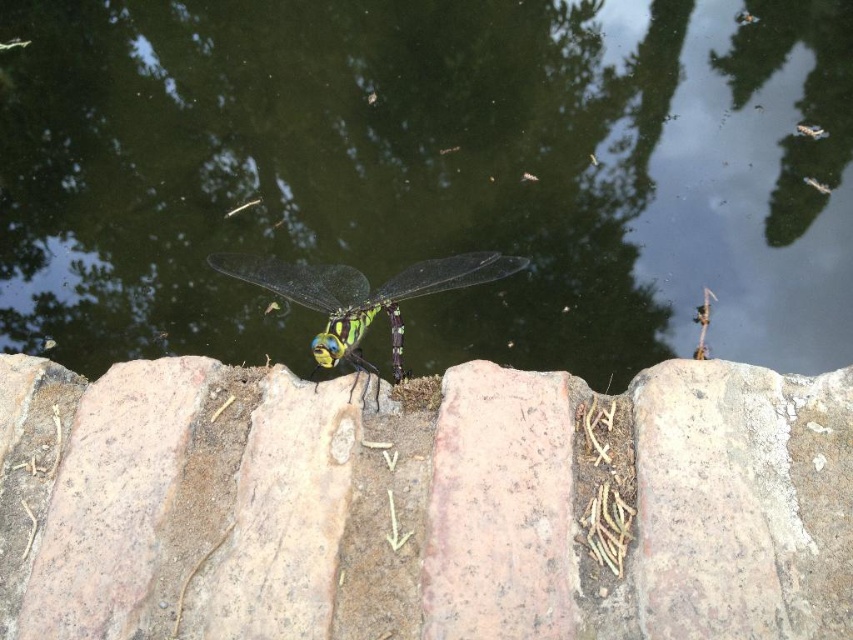
Can you confirm if greenish water at center is positioned above smooth stone at center?

Yes.

Does point (476, 40) come farther from viewer compared to point (236, 589)?

That is True.

Does point (639, 289) come in front of point (267, 608)?

No, it is behind (267, 608).

Identify the location of greenish water at center. The image size is (853, 640). (430, 173).

Can you confirm if greenish water at center is positioned to the left of transparent glass dragonfly at center?

No, greenish water at center is not to the left of transparent glass dragonfly at center.

Between point (39, 204) and point (257, 266), which one is positioned behind?

The point (39, 204) is more distant.

Locate an element on the screen. Image resolution: width=853 pixels, height=640 pixels. greenish water at center is located at coordinates (430, 173).

The image size is (853, 640). I want to click on smooth stone at center, so click(416, 506).